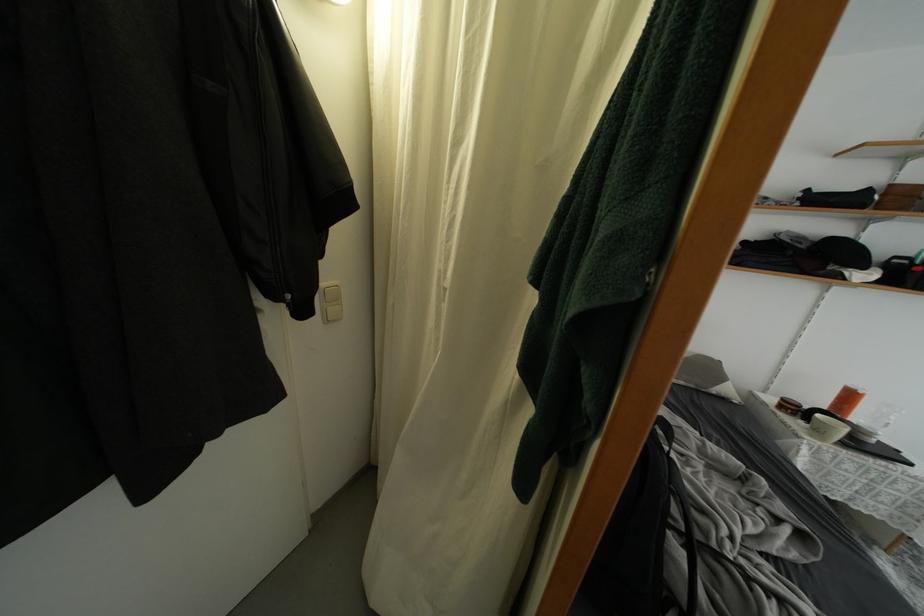
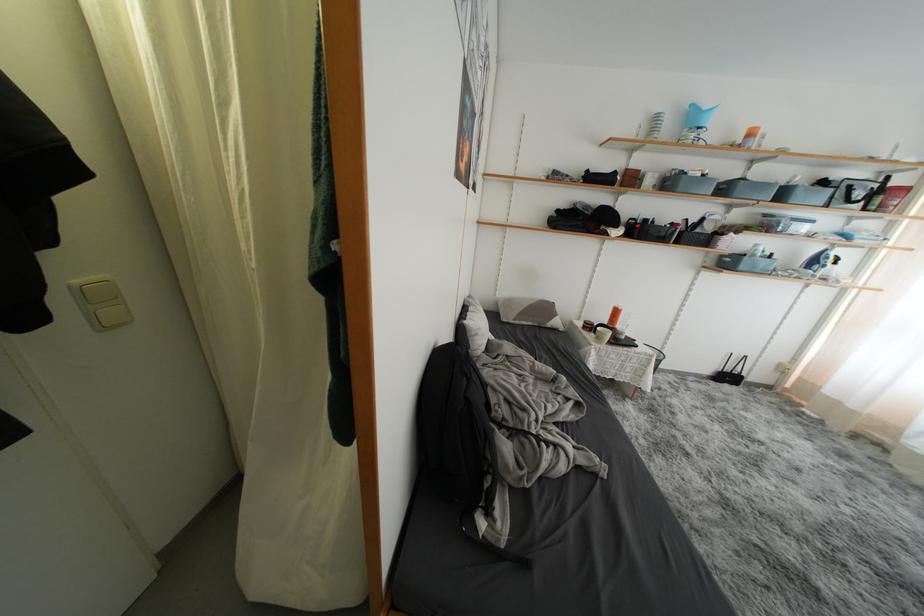
What movement of the cameraman would produce the second image?

The cameraman moved toward right, backward.